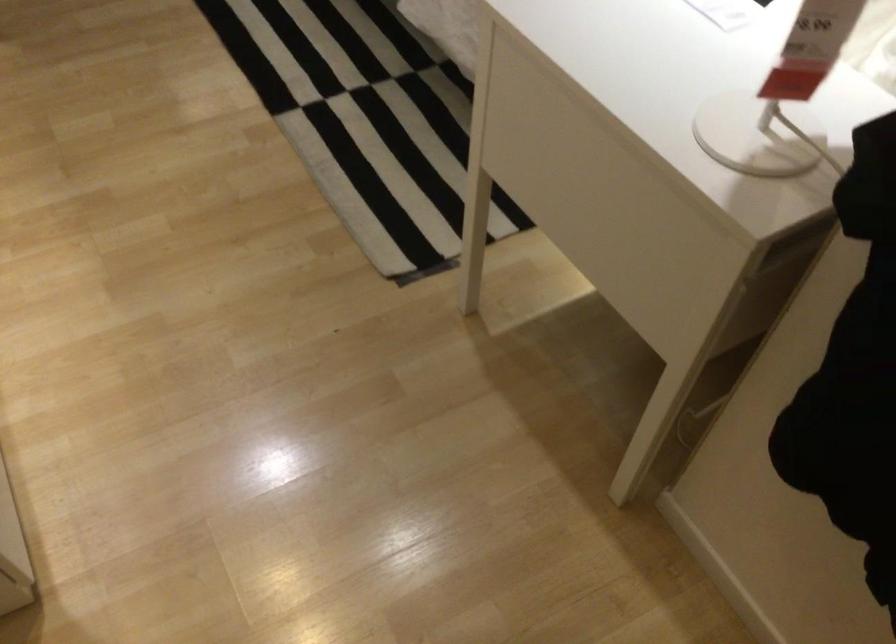
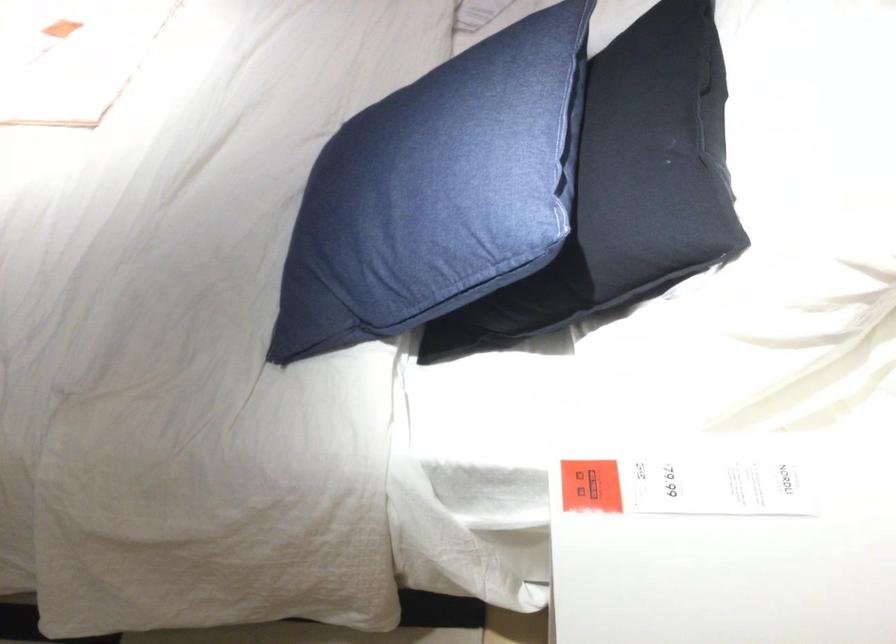
Question: The camera is either moving clockwise (left) or counter-clockwise (right) around the object. The first image is from the beginning of the video and the second image is from the end. Is the camera moving left or right when shooting the video?

Choices:
 (A) Left
 (B) Right

Answer: (A)